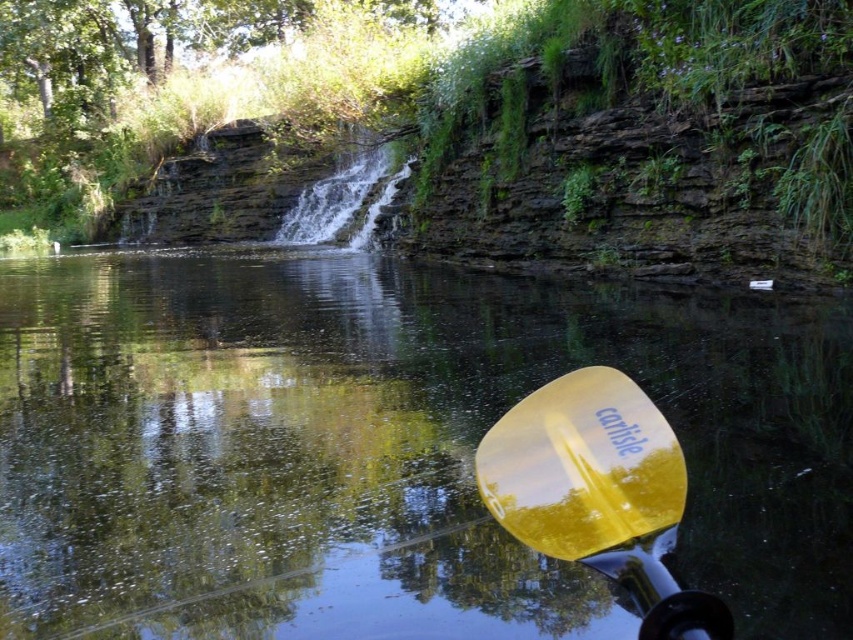
Question: Is transparent plastic paddle at lower right to the left of yellow glossy paddle at lower right from the viewer's perspective?

Choices:
 (A) yes
 (B) no

Answer: (A)

Question: Can you confirm if transparent plastic paddle at lower right is bigger than yellow glossy paddle at lower right?

Choices:
 (A) no
 (B) yes

Answer: (B)

Question: Can you confirm if transparent plastic paddle at lower right is positioned below yellow glossy paddle at lower right?

Choices:
 (A) yes
 (B) no

Answer: (B)

Question: Which point is farther from the camera taking this photo?

Choices:
 (A) (668, 477)
 (B) (474, 561)

Answer: (B)